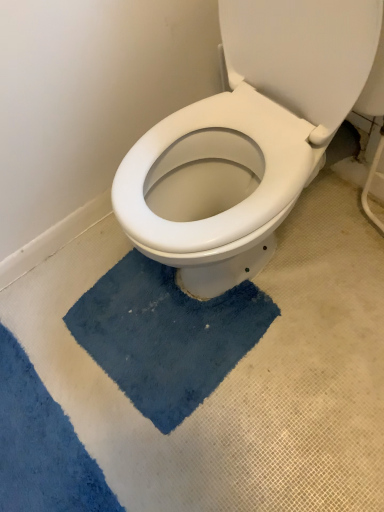
Image resolution: width=384 pixels, height=512 pixels. What are the coordinates of `vacant region under blue plush bath mat at lower center, marked as the 2th bath mat in a right-to-left arrangement (from a real-world perspective)` in the screenshot? It's located at (32, 445).